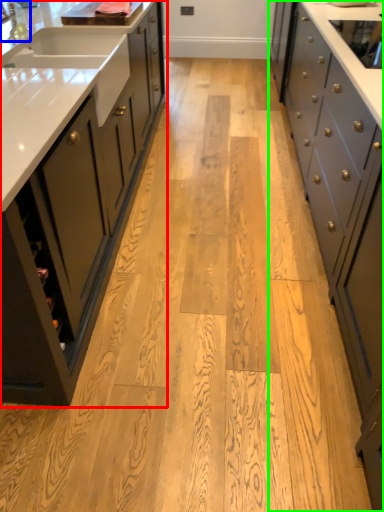
Question: Based on their relative distances, which object is farther from cabinetry (highlighted by a red box)? Choose from faucet (highlighted by a blue box) and cabinetry (highlighted by a green box).

Choices:
 (A) faucet
 (B) cabinetry

Answer: (B)